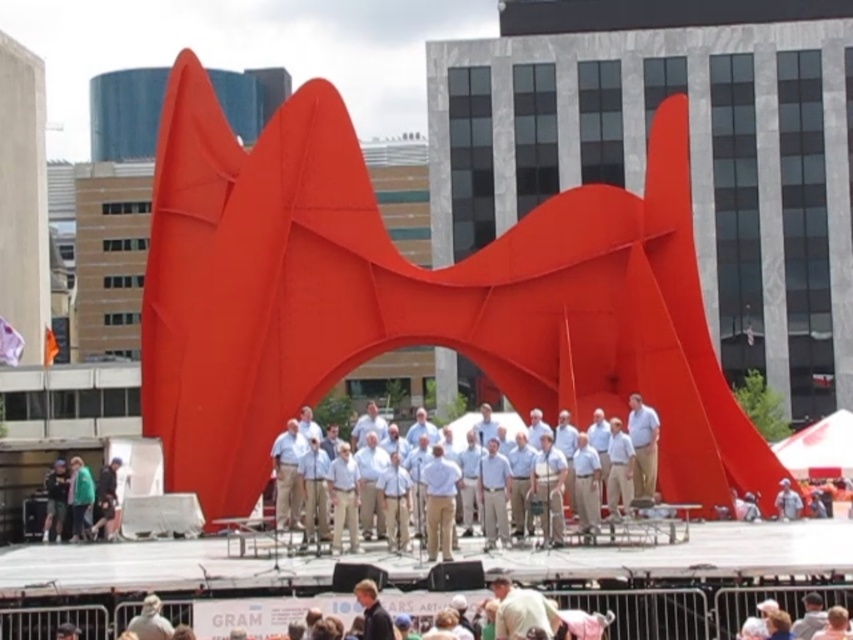
You are a photographer trying to capture a clear shot of the matte red sculpture at center and the light blue shirt at center. Since the sculpture is larger, where should you position yourself to ensure both are visible in the frame?

The matte red sculpture at center is larger in size than the light blue shirt at center, so you should position yourself farther back to ensure both are visible in the frame.

You are a photographer trying to capture a clear shot of both the light blue shirt at center and the tan fabric shirt at center from the front. Which one might appear larger in your photo?

The light blue shirt at center appears larger in the photo because it is much taller than the tan fabric shirt at center.

You are standing at the origin point of the image. Where is the light blue shirt at center located in terms of coordinates?

The light blue shirt at center is located at point [625,451].